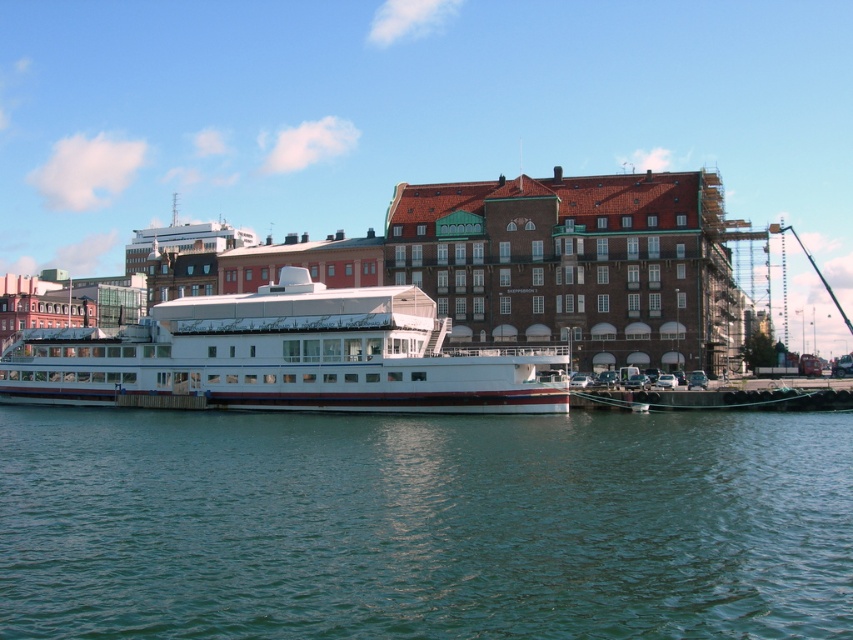
Who is higher up, green water at lower center or white glossy boat at center?

white glossy boat at center is above.

At what (x,y) coordinates should I click in order to perform the action: click on green water at lower center. Please return your answer as a coordinate pair (x, y). This screenshot has width=853, height=640. Looking at the image, I should click on (424, 524).

Is point (263, 618) in front of point (126, 385)?

Yes, point (263, 618) is in front of point (126, 385).

You are a GUI agent. You are given a task and a screenshot of the screen. Output one action in this format:
    pyautogui.click(x=<x>, y=<y>)
    Task: Click on the green water at lower center
    The image size is (853, 640).
    Given the screenshot: What is the action you would take?
    pyautogui.click(x=424, y=524)